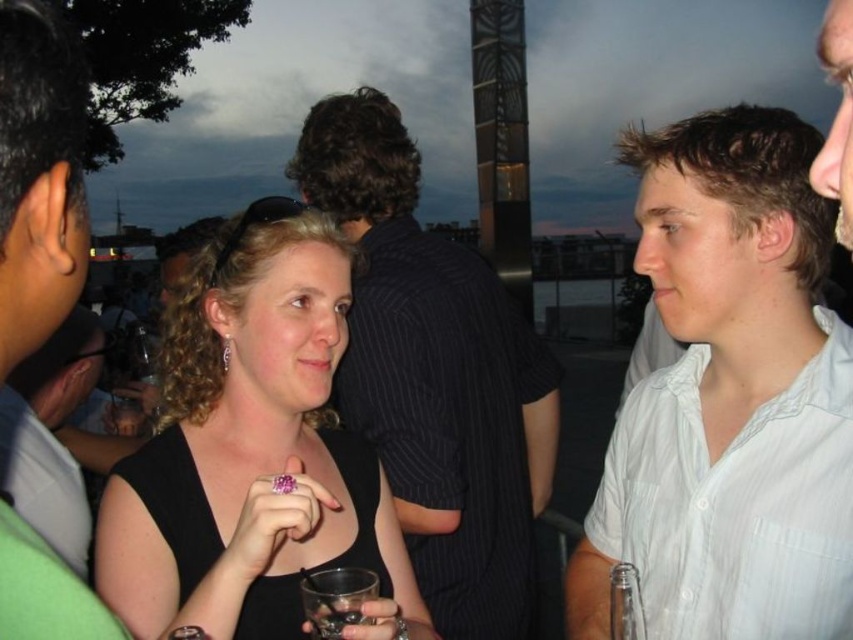
Question: Can you confirm if black matte dress at center is positioned below white striped shirt at right?

Choices:
 (A) yes
 (B) no

Answer: (B)

Question: Which of the following is the closest to the observer?

Choices:
 (A) (368, 620)
 (B) (370, 260)
 (C) (643, 513)

Answer: (A)

Question: Considering the relative positions of black matte dress at center and black striped shirt at center in the image provided, where is black matte dress at center located with respect to black striped shirt at center?

Choices:
 (A) right
 (B) left

Answer: (B)

Question: Which object is the closest to the white striped shirt at right?

Choices:
 (A) clear glass at lower center
 (B) black striped shirt at center
 (C) transparent glass at lower center
 (D) black matte dress at center

Answer: (B)

Question: Which of these objects is positioned closest to the black striped shirt at center?

Choices:
 (A) black matte dress at center
 (B) transparent glass at lower center
 (C) clear glass at lower center
 (D) white striped shirt at right

Answer: (A)

Question: Observing the image, what is the correct spatial positioning of white striped shirt at right in reference to transparent glass at lower center?

Choices:
 (A) right
 (B) left

Answer: (A)